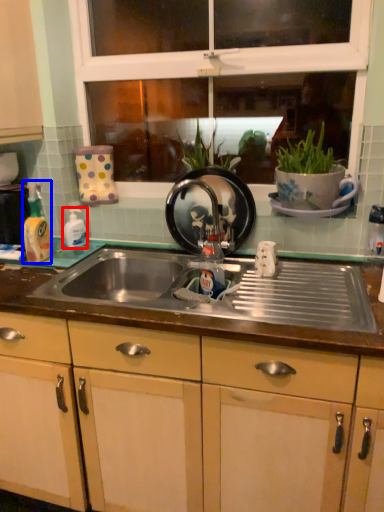
Question: Which of the following is the closest to the observer, bottle (highlighted by a red box) or bottle (highlighted by a blue box)?

Choices:
 (A) bottle
 (B) bottle

Answer: (B)